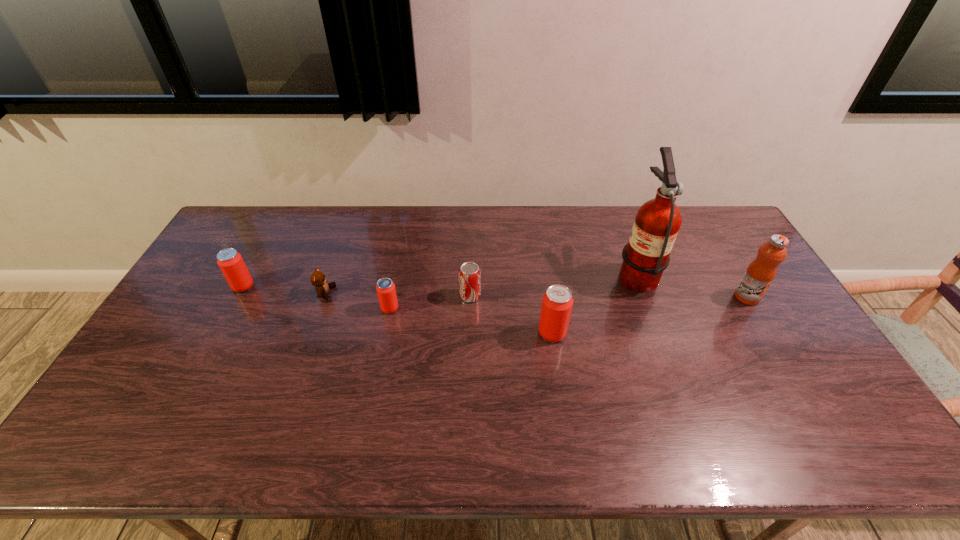
This screenshot has height=540, width=960. In order to click on free location located 0.110m on the left of the fourth object from right to left in this screenshot , I will do `click(424, 296)`.

Locate an element on the screen. Image resolution: width=960 pixels, height=540 pixels. vacant space located on the front-facing side of the teddy bear is located at coordinates (462, 294).

Where is `object at the left edge`? Image resolution: width=960 pixels, height=540 pixels. object at the left edge is located at coordinates (231, 263).

Image resolution: width=960 pixels, height=540 pixels. In order to click on object present at the right edge in this screenshot , I will do `click(760, 273)`.

Where is `vacant space at the far edge`? This screenshot has height=540, width=960. vacant space at the far edge is located at coordinates (521, 222).

In the image, there is a desktop. Identify the location of vacant space at the near edge. The height and width of the screenshot is (540, 960). (700, 390).

Image resolution: width=960 pixels, height=540 pixels. I want to click on vacant region at the left edge of the desktop, so click(x=204, y=299).

Find the location of a particular element. This screenshot has height=540, width=960. free space at the right edge of the desktop is located at coordinates (716, 268).

The width and height of the screenshot is (960, 540). In the image, there is a desktop. Identify the location of blank space at the far left corner. (264, 205).

Image resolution: width=960 pixels, height=540 pixels. In order to click on blank space at the near left corner of the desktop in this screenshot , I will do `click(176, 384)`.